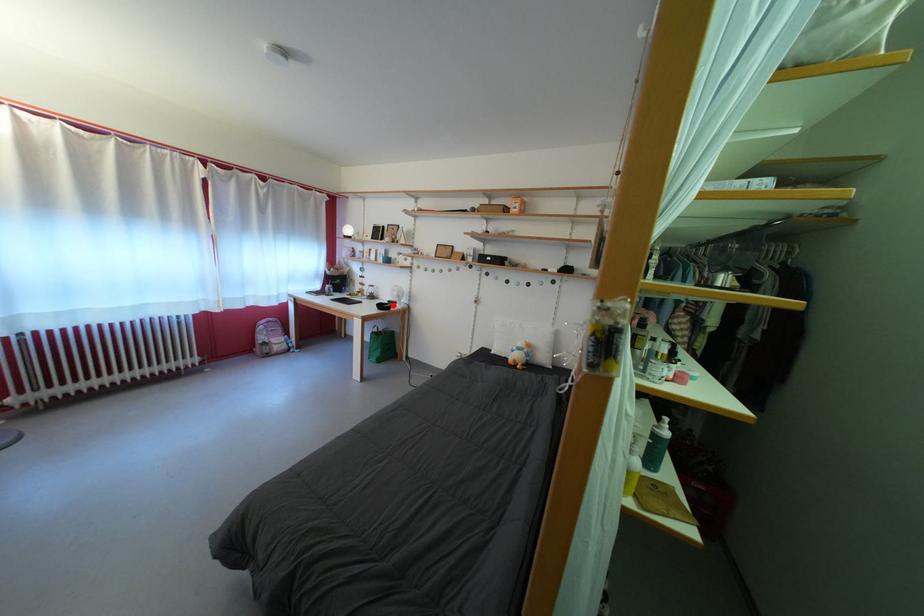
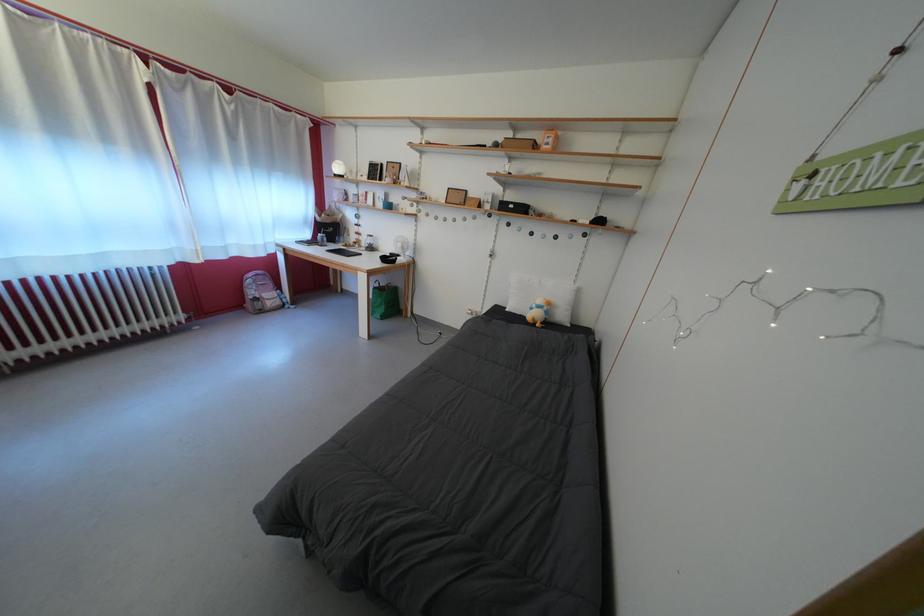
Question: I am providing you with two images of the same scene from different viewpoints. Given a red point in image1, look at the same physical point in image2. Is it:

Choices:
 (A) Closer to the viewpoint
 (B) Farther from the viewpoint

Answer: (A)